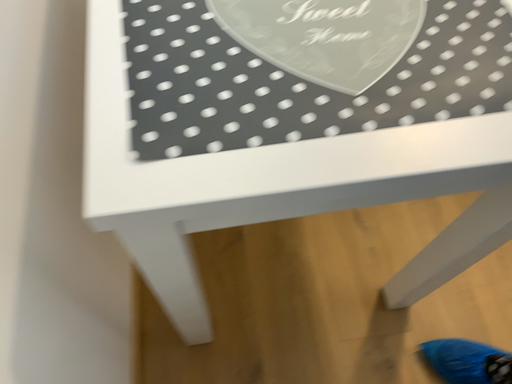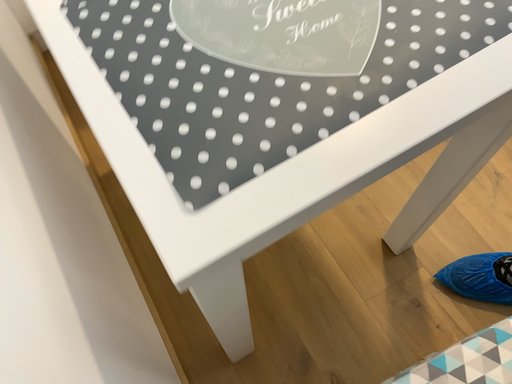
Question: How did the camera likely rotate when shooting the video?

Choices:
 (A) rotated left
 (B) rotated right

Answer: (B)